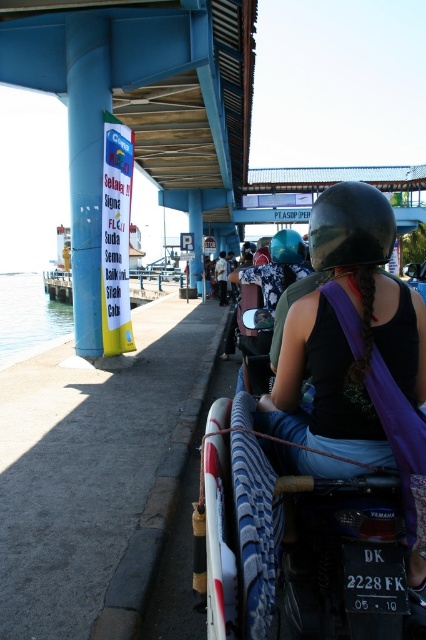
You are a photographer trying to capture the motorcycle and its surroundings. Based on the scene, which object, the clear blue water at lower left or the glossy black helmet at upper center, would appear larger in your photo if both are in focus?

The clear blue water at lower left would appear larger in the photo since it is taller than the glossy black helmet at upper center.

You are a photographer trying to capture both the matte black helmet at center and the glossy black helmet at upper center in a single shot. However, due to the lighting conditions, you can only focus on one helmet at a time. Which helmet should you focus on first to ensure the other remains in the background?

You should focus on the matte black helmet at center first because it is in front of the glossy black helmet at upper center, so adjusting focus to the foreground helmet will keep the background helmet in relative clarity.